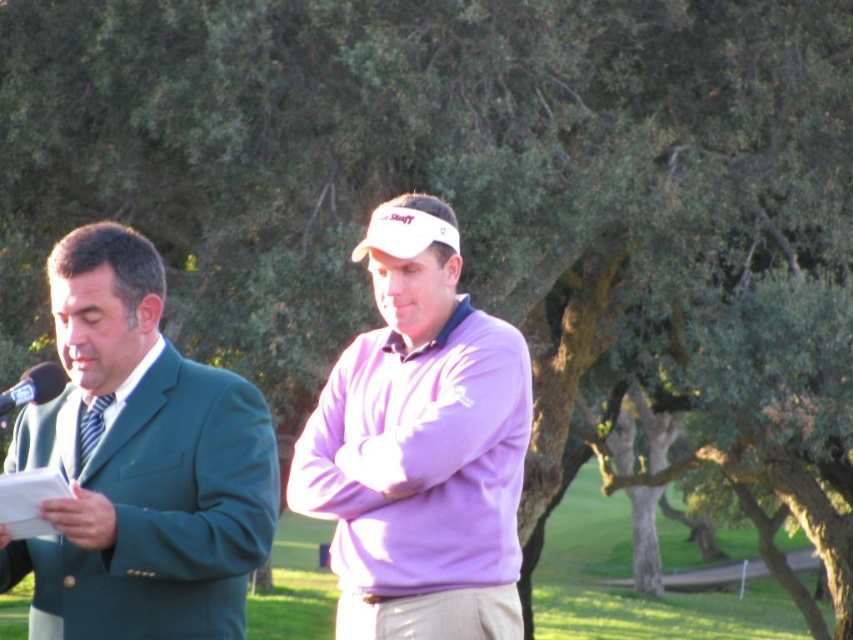
Question: Is black plastic microphone at left closer to camera compared to striped fabric tie at left?

Choices:
 (A) yes
 (B) no

Answer: (A)

Question: Which of the following is the closest to the observer?

Choices:
 (A) striped fabric tie at left
 (B) black plastic microphone at left
 (C) green grass at center

Answer: (B)

Question: Which point is farther to the camera?

Choices:
 (A) (41, 381)
 (B) (94, 442)

Answer: (B)

Question: Can you confirm if green grass at center is positioned below black plastic microphone at left?

Choices:
 (A) yes
 (B) no

Answer: (A)

Question: Can you confirm if purple fleece sweater at center is positioned to the left of green grass at center?

Choices:
 (A) yes
 (B) no

Answer: (B)

Question: Estimate the real-world distances between objects in this image. Which object is farther from the purple fleece sweater at center?

Choices:
 (A) black plastic microphone at left
 (B) green grass at center

Answer: (B)